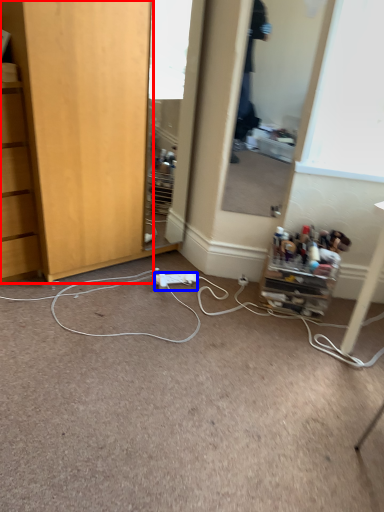
Question: Which object is closer to the camera taking this photo, cabinetry (highlighted by a red box) or power outlet (highlighted by a blue box)?

Choices:
 (A) cabinetry
 (B) power outlet

Answer: (A)